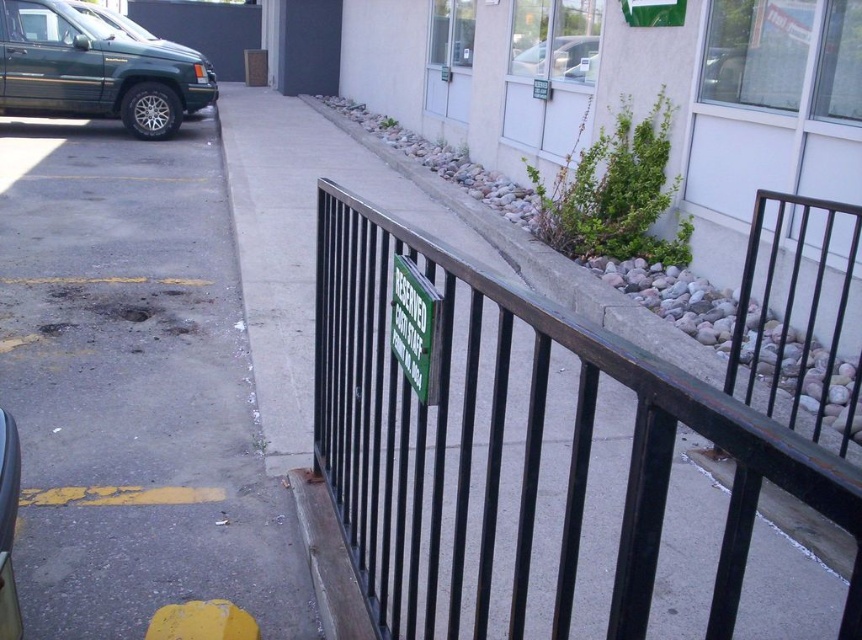
Is gray asphalt at left below green matte suv at left?

Yes, gray asphalt at left is below green matte suv at left.

Is gray asphalt at left above green matte suv at left?

Actually, gray asphalt at left is below green matte suv at left.

Is point (247, 572) less distant than point (61, 60)?

That is True.

Where is `gray asphalt at left`? Image resolution: width=862 pixels, height=640 pixels. gray asphalt at left is located at coordinates (133, 388).

Can you confirm if green matte suv at left is bigger than green matte sign at center?

Yes, green matte suv at left is bigger than green matte sign at center.

Measure the distance between green matte suv at left and camera.

green matte suv at left is 5.25 meters from camera.

Between point (95, 29) and point (403, 298), which one is positioned in front?

Point (403, 298) is more forward.

You are a GUI agent. You are given a task and a screenshot of the screen. Output one action in this format:
    pyautogui.click(x=<x>, y=<y>)
    Task: Click on the green matte suv at left
    This screenshot has height=640, width=862.
    Given the screenshot: What is the action you would take?
    pyautogui.click(x=92, y=72)

Does point (97, 81) come in front of point (513, 65)?

No, it is behind (513, 65).

Can you confirm if green matte suv at left is positioned to the left of metallic silver sedan at upper center?

Yes, green matte suv at left is to the left of metallic silver sedan at upper center.

Identify the location of green matte suv at left. (92, 72).